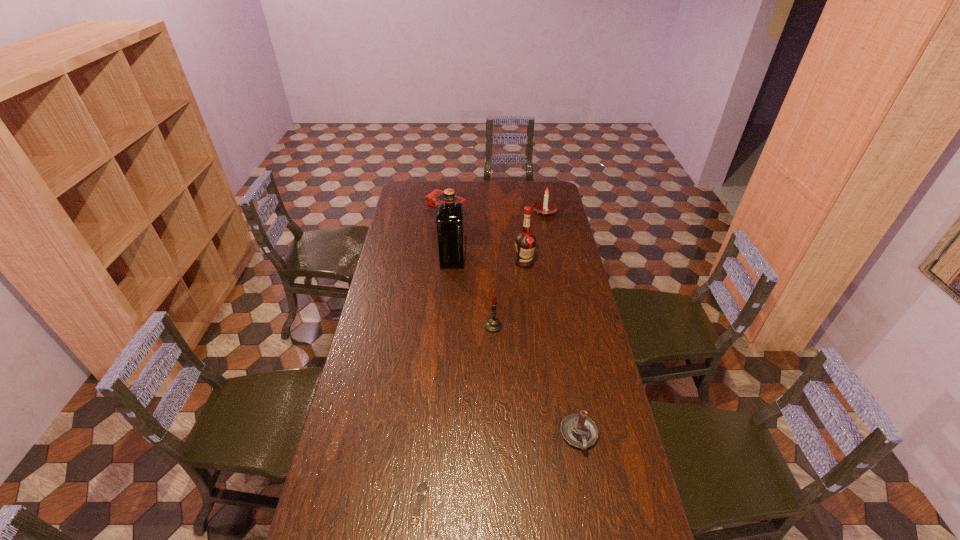
The width and height of the screenshot is (960, 540). What are the coordinates of `the tallest object` in the screenshot? It's located at (450, 216).

I want to click on the taller liquor, so click(x=450, y=216).

At what (x,y) coordinates should I click in order to perform the action: click on the shorter liquor. Please return your answer as a coordinate pair (x, y). The width and height of the screenshot is (960, 540). Looking at the image, I should click on (525, 242).

At what (x,y) coordinates should I click in order to perform the action: click on the sixth shortest object. Please return your answer as a coordinate pair (x, y). Looking at the image, I should click on (525, 242).

Where is `the leftmost candle`? the leftmost candle is located at coordinates (493, 325).

What are the coordinates of `the tallest candle` in the screenshot? It's located at (493, 325).

Identify the location of the second tallest candle. This screenshot has width=960, height=540. (544, 207).

Where is `camera`? The width and height of the screenshot is (960, 540). camera is located at coordinates (432, 199).

You are a GUI agent. You are given a task and a screenshot of the screen. Output one action in this format:
    pyautogui.click(x=<x>, y=<y>)
    Task: Click on the shortest candle
    This screenshot has width=960, height=540.
    Given the screenshot: What is the action you would take?
    pyautogui.click(x=578, y=430)

This screenshot has width=960, height=540. I want to click on the second nearest object, so click(x=578, y=430).